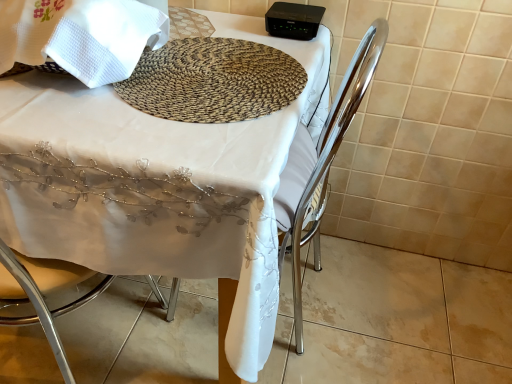
You are a GUI agent. You are given a task and a screenshot of the screen. Output one action in this format:
    pyautogui.click(x=<x>, y=<y>)
    Task: Click on the free space to the right of metallic silver chair at center
    The height and width of the screenshot is (384, 512).
    Given the screenshot: What is the action you would take?
    pyautogui.click(x=394, y=310)